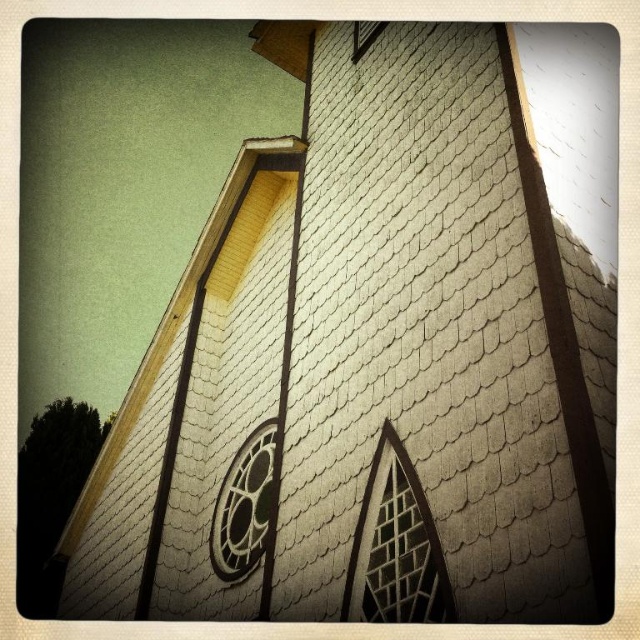
Describe the element at coordinates (244, 506) in the screenshot. I see `black glass window at center` at that location.

Is black glass window at center closer to camera compared to clear glass window at upper center?

Yes, black glass window at center is in front of clear glass window at upper center.

Is point (262, 531) farther from camera compared to point (353, 45)?

No, it is in front of (353, 45).

Locate an element on the screen. The image size is (640, 640). black glass window at center is located at coordinates (244, 506).

Between translucent glass window at center and clear glass window at upper center, which one is positioned lower?

translucent glass window at center is below.

Which is in front, point (360, 545) or point (355, 51)?

Positioned in front is point (360, 545).

Between point (404, 602) and point (353, 49), which one is positioned in front?

Point (404, 602) is more forward.

Where is `translucent glass window at center`? translucent glass window at center is located at coordinates (396, 547).

Between point (419, 548) and point (221, 499), which one is positioned behind?

Positioned behind is point (221, 499).

Is point (365, 573) more distant than point (228, 513)?

No, (365, 573) is in front of (228, 513).

Where is `translucent glass window at center`? This screenshot has width=640, height=640. translucent glass window at center is located at coordinates (396, 547).